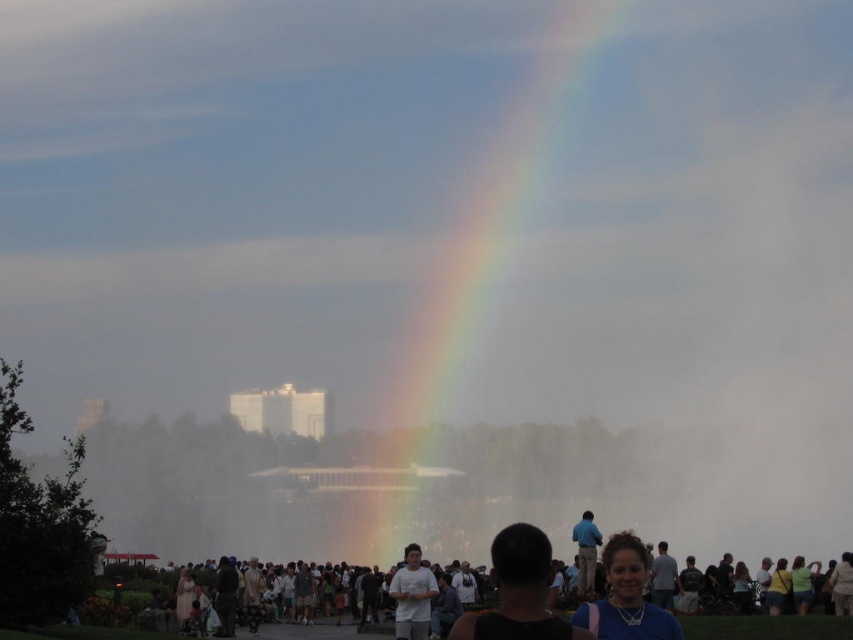
Between rainbow at center and matte white people at lower center, which one appears on the right side from the viewer's perspective?

From the viewer's perspective, rainbow at center appears more on the right side.

Is rainbow at center to the left of matte white people at lower center from the viewer's perspective?

No, rainbow at center is not to the left of matte white people at lower center.

Between point (537, 108) and point (790, 616), which one is positioned behind?

Point (537, 108)

I want to click on rainbow at center, so point(491,209).

Which is above, white matte shirt at center or blue cotton shirt at center?

blue cotton shirt at center

You are a GUI agent. You are given a task and a screenshot of the screen. Output one action in this format:
    pyautogui.click(x=<x>, y=<y>)
    Task: Click on the white matte shirt at center
    
    Given the screenshot: What is the action you would take?
    pyautogui.click(x=412, y=595)

From the picture: Does black hair at center appear on the right side of matte white people at lower center?

Indeed, black hair at center is positioned on the right side of matte white people at lower center.

Is point (547, 611) behind point (767, 620)?

That is False.

This screenshot has width=853, height=640. I want to click on black hair at center, so click(518, 592).